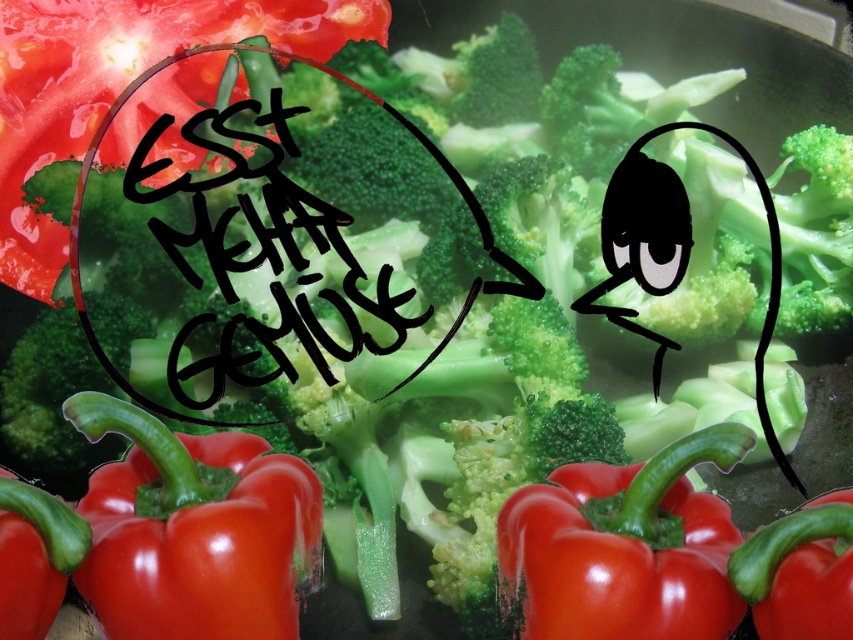
Looking at the vegetables in the pan, which object is positioned higher up between the shiny red tomato at upper left and the glossy red bell pepper at center?

The shiny red tomato at upper left is positioned higher up than the glossy red bell pepper at center.

Which vegetable is marked by the point at coordinates (x=193, y=531)?

The point at coordinates (x=193, y=531) marks the shiny red bell pepper at lower left.